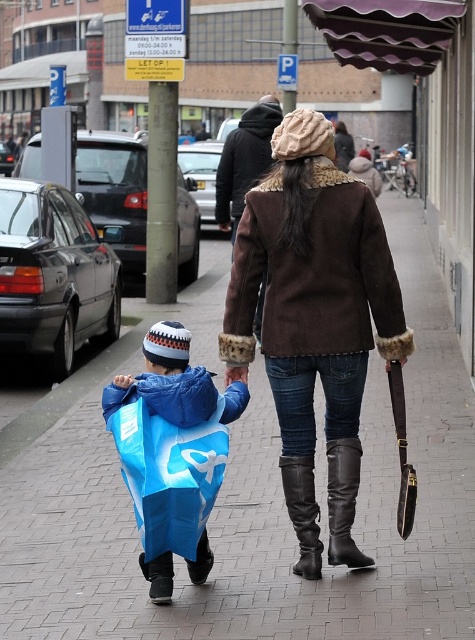
Question: Where is brown fur-trimmed coat at center located in relation to blue fabric bag at lower left in the image?

Choices:
 (A) above
 (B) below

Answer: (A)

Question: Which of the following is the closest to the observer?

Choices:
 (A) (314, 355)
 (B) (354, 451)
 (C) (38, 554)
 (D) (150, 364)

Answer: (D)

Question: Considering the real-world distances, which object is closest to the black leather boot at lower center?

Choices:
 (A) brown fur-trimmed coat at center
 (B) black leather boot at center

Answer: (B)

Question: Among these objects, which one is farthest from the camera?

Choices:
 (A) black leather boot at lower center
 (B) blue fabric bag at lower left
 (C) black leather boot at center

Answer: (A)

Question: Does brick pavement at center lie behind black leather boot at lower center?

Choices:
 (A) no
 (B) yes

Answer: (A)

Question: Can you confirm if brick pavement at center is positioned above black leather boot at lower center?

Choices:
 (A) no
 (B) yes

Answer: (B)